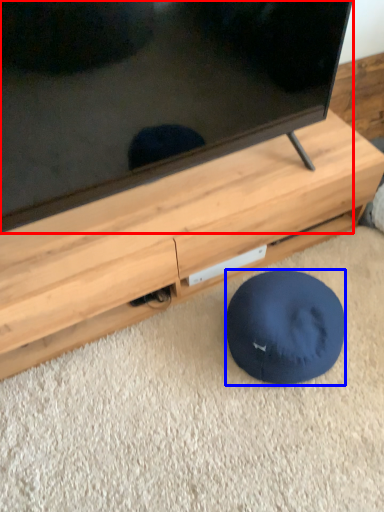
Question: Which point is further to the camera, television (highlighted by a red box) or dog bed (highlighted by a blue box)?

Choices:
 (A) television
 (B) dog bed

Answer: (B)